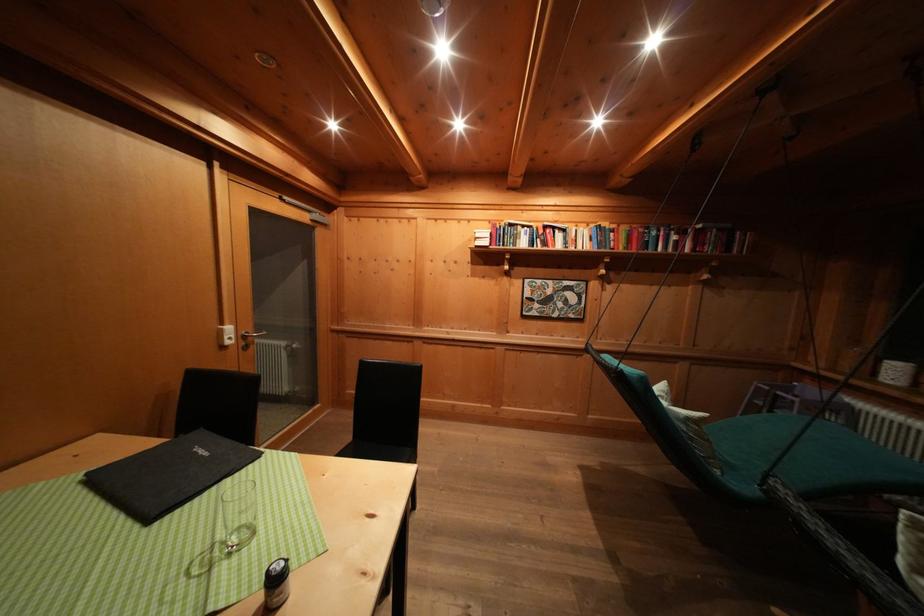
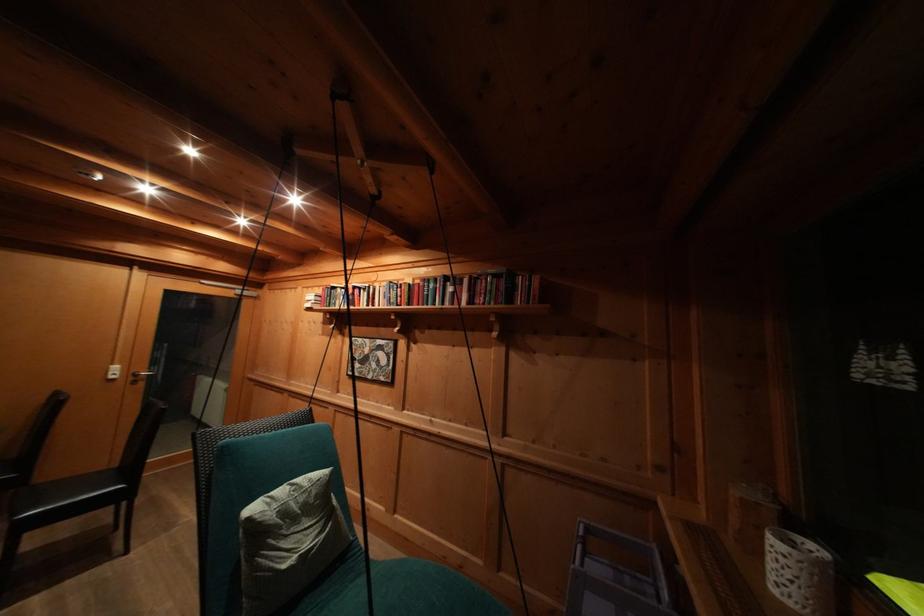
Question: The images are taken continuously from a first-person perspective. In which direction are you moving?

Choices:
 (A) Left
 (B) Right
 (C) Forward
 (D) Backward

Answer: (B)